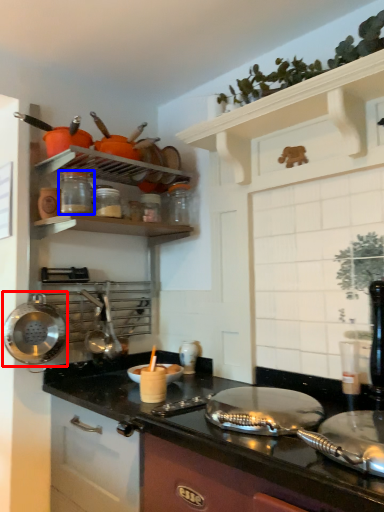
Question: Which of the following is the farthest to the observer, wok (highlighted by a red box) or appliance (highlighted by a blue box)?

Choices:
 (A) wok
 (B) appliance

Answer: (B)